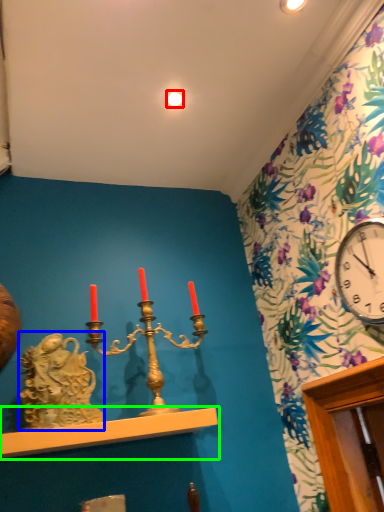
Question: Estimate the real-world distances between objects in this image. Which object is closer to light (highlighted by a red box), sculpture (highlighted by a blue box) or shelf (highlighted by a green box)?

Choices:
 (A) sculpture
 (B) shelf

Answer: (A)